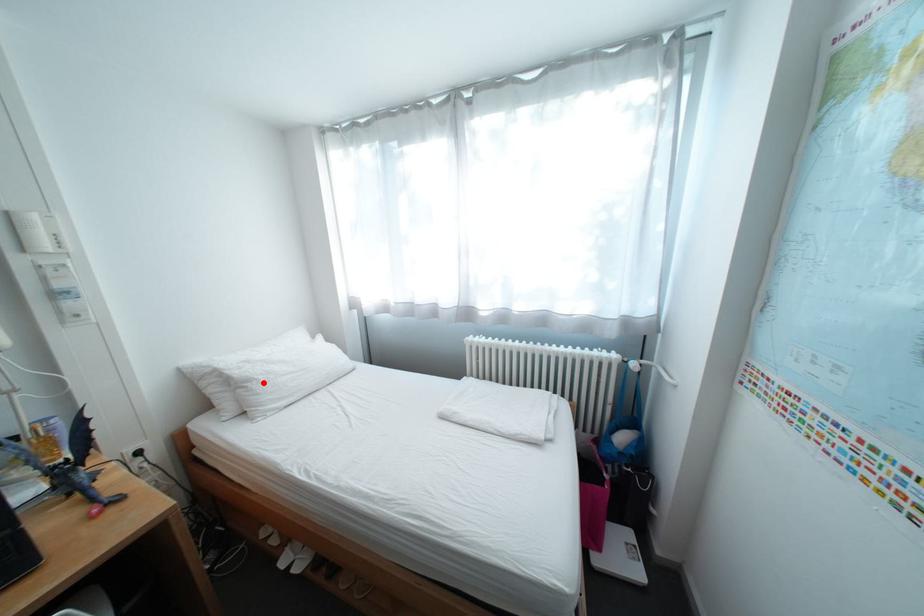
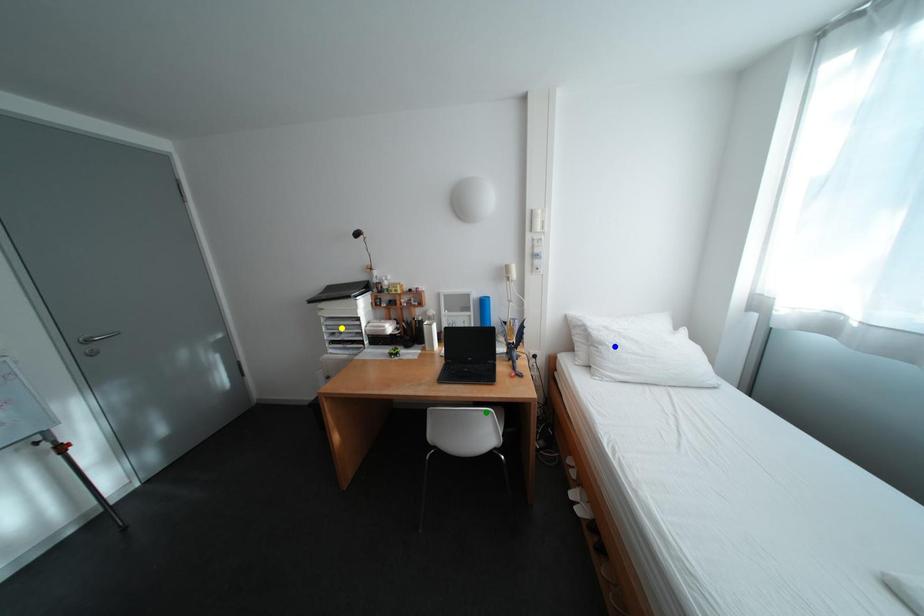
Question: I am providing you with two images of the same scene from different viewpoints. A red point is marked on the first image. You are given multiple points on the second image. Which point in image 2 is actually the same real-world point as the red point in image 1?

Choices:
 (A) green point
 (B) yellow point
 (C) blue point

Answer: (C)